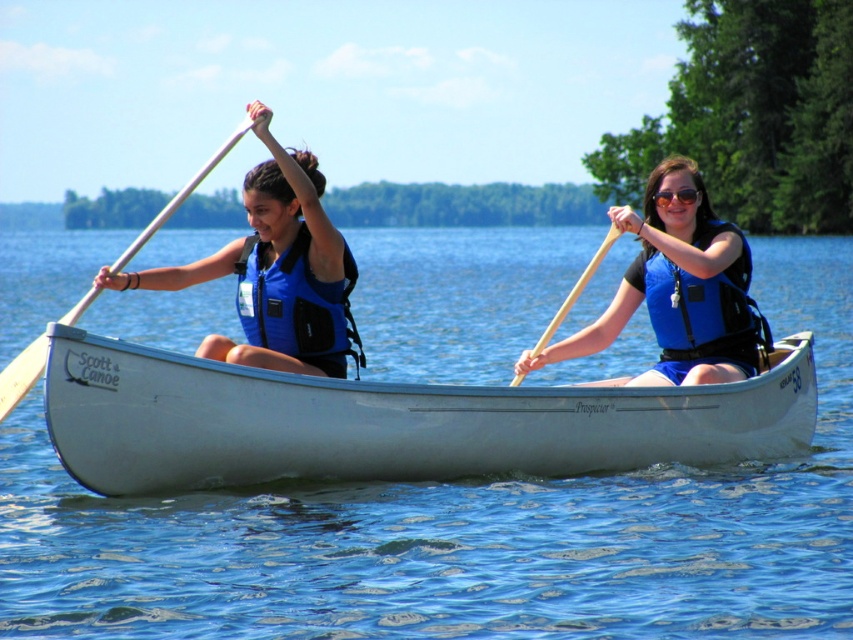
Consider the image. Which of these two, white matte canoe at center or matte black goggles at center, stands shorter?

matte black goggles at center

Is white matte canoe at center further to camera compared to matte black goggles at center?

No, it is not.

Which is behind, point (225, 429) or point (659, 198)?

Point (659, 198)

At what (x,y) coordinates should I click in order to perform the action: click on white matte canoe at center. Please return your answer as a coordinate pair (x, y). The image size is (853, 640). Looking at the image, I should click on (392, 420).

Who is taller, blue/textured life jacket at center or blue matte life jacket at center?

blue matte life jacket at center

Is point (340, 289) farther from camera compared to point (734, 342)?

That is False.

Where is `blue/textured life jacket at center`? The image size is (853, 640). blue/textured life jacket at center is located at coordinates (296, 305).

Between blue/textured life jacket at center and matte black goggles at center, which one appears on the left side from the viewer's perspective?

blue/textured life jacket at center

Find the location of a particular element. The image size is (853, 640). blue/textured life jacket at center is located at coordinates (296, 305).

At what (x,y) coordinates should I click in order to perform the action: click on blue/textured life jacket at center. Please return your answer as a coordinate pair (x, y). This screenshot has height=640, width=853. Looking at the image, I should click on (296, 305).